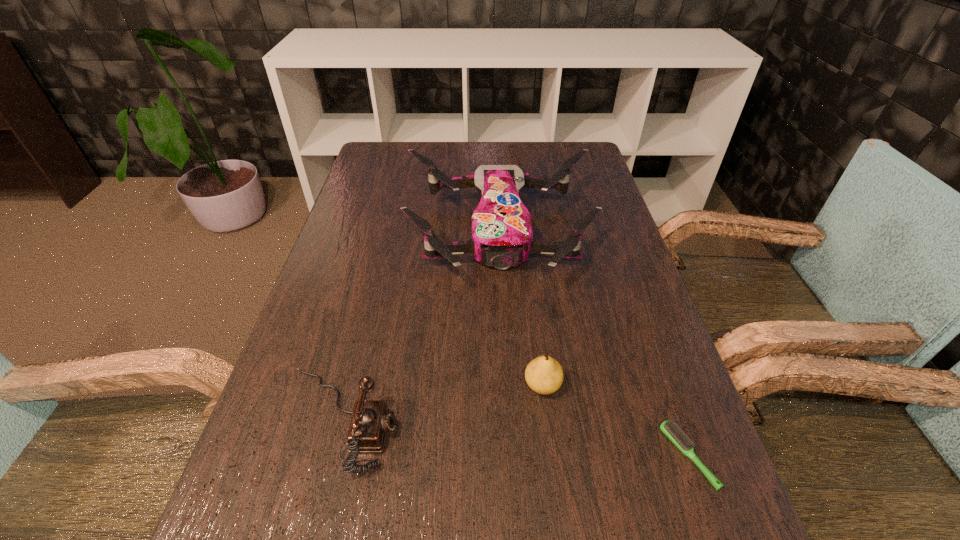
At what (x,y) coordinates should I click in order to perform the action: click on vacant space that's between the pear and the farthest object. Please return your answer as a coordinate pair (x, y). The image size is (960, 540). Looking at the image, I should click on (521, 308).

You are a GUI agent. You are given a task and a screenshot of the screen. Output one action in this format:
    pyautogui.click(x=<x>, y=<y>)
    Task: Click on the free space between the tallest object and the shortest object
    The image size is (960, 540).
    Given the screenshot: What is the action you would take?
    pyautogui.click(x=594, y=344)

The height and width of the screenshot is (540, 960). In order to click on free space that is in between the telephone and the drone in this screenshot , I will do pos(420,326).

Where is `free space between the pear and the drone`? The image size is (960, 540). free space between the pear and the drone is located at coordinates (521, 308).

Identify the location of free spot between the shortest object and the telephone. The width and height of the screenshot is (960, 540). (515, 438).

Locate an element on the screen. free spot between the shortest object and the pear is located at coordinates (615, 421).

Where is `unoccupied area between the farthest object and the pear`? The height and width of the screenshot is (540, 960). unoccupied area between the farthest object and the pear is located at coordinates (521, 308).

Identify which object is the second closest to the tallest object. Please provide its 2D coordinates. Your answer should be formatted as a tuple, i.e. [(x, y)], where the tuple contains the x and y coordinates of a point satisfying the conditions above.

[(371, 419)]

Locate which object is the second closest to the shortest object. Please provide its 2D coordinates. Your answer should be formatted as a tuple, i.e. [(x, y)], where the tuple contains the x and y coordinates of a point satisfying the conditions above.

[(502, 233)]

Locate an element on the screen. vacant point that satisfies the following two spatial constraints: 1. on the front-facing side of the pear; 2. on the left side of the tallest object is located at coordinates (508, 385).